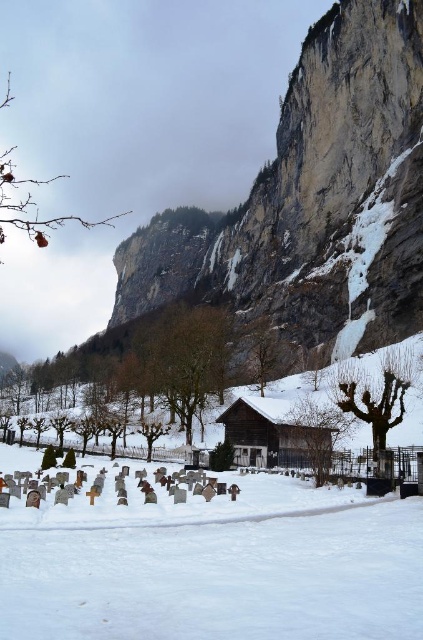
Who is more forward, (348, 541) or (260, 426)?

Point (348, 541)

Is white powdery snow at center to the right of wooden cabin at center from the viewer's perspective?

In fact, white powdery snow at center is to the left of wooden cabin at center.

Between point (419, 580) and point (236, 401), which one is positioned in front?

Point (419, 580) is more forward.

The image size is (423, 640). In order to click on white powdery snow at center in this screenshot , I will do `click(214, 564)`.